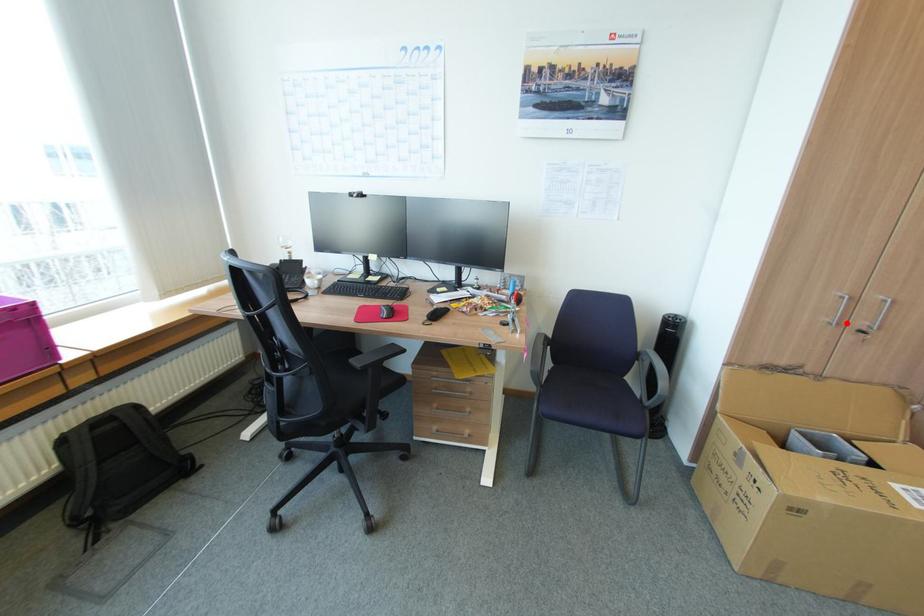
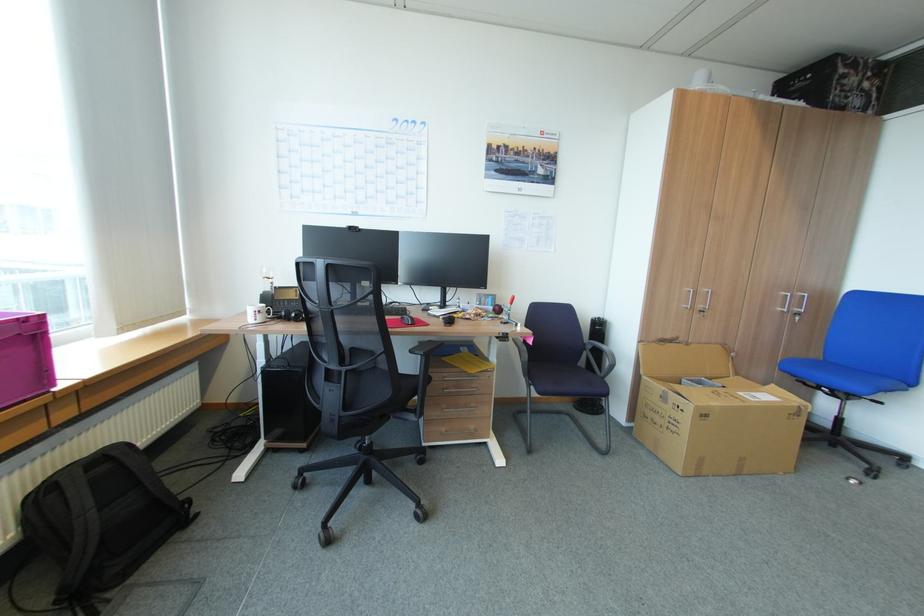
Locate, in the second image, the point that corresponds to the highlighted location in the first image.

(698, 307)